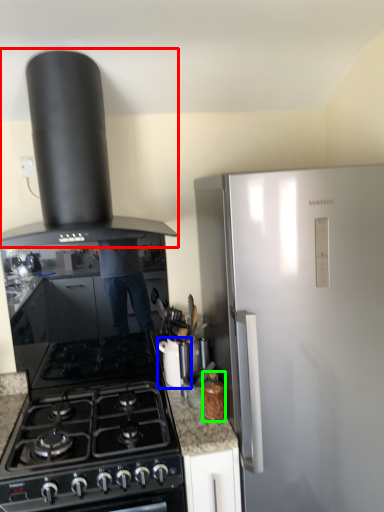
Question: Considering the real-world distances, which object is farthest from kitchen appliance (highlighted by a red box)? kitchen appliance (highlighted by a blue box) or kitchen appliance (highlighted by a green box)?

Choices:
 (A) kitchen appliance
 (B) kitchen appliance

Answer: (B)